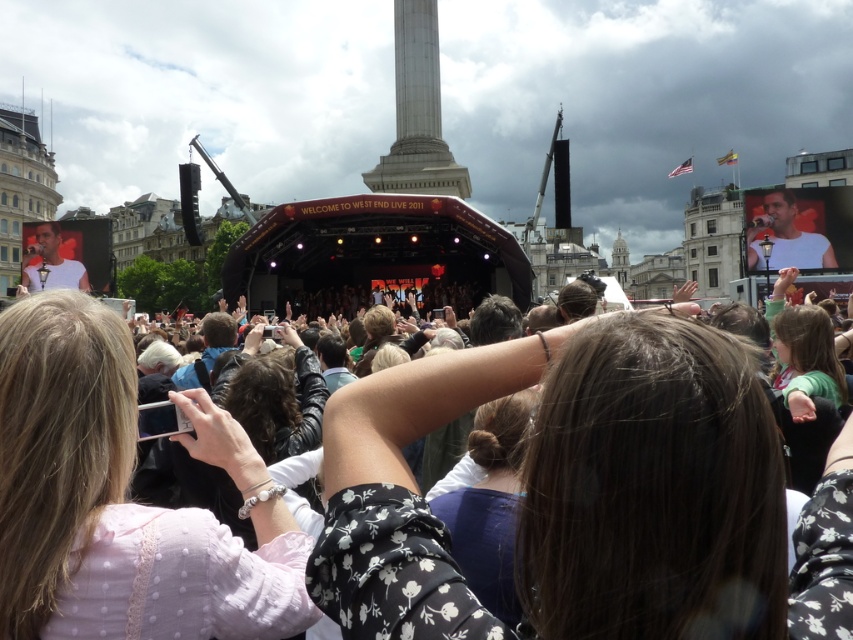
Describe the element at coordinates (589, 496) in the screenshot. This screenshot has height=640, width=853. I see `black floral shirt at center` at that location.

Does black floral shirt at center appear under pink fabric at center?

Actually, black floral shirt at center is above pink fabric at center.

In order to click on black floral shirt at center in this screenshot , I will do `click(589, 496)`.